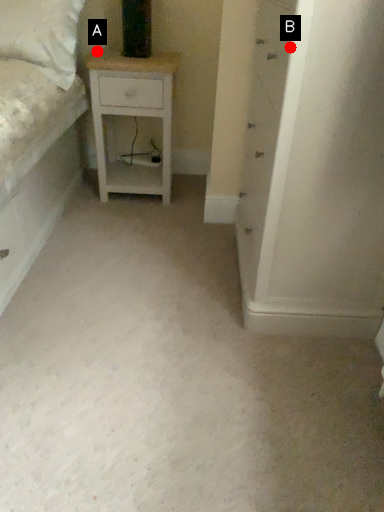
Question: Two points are circled on the image, labeled by A and B beside each circle. Which point is further to the camera?

Choices:
 (A) A is further
 (B) B is further

Answer: (A)